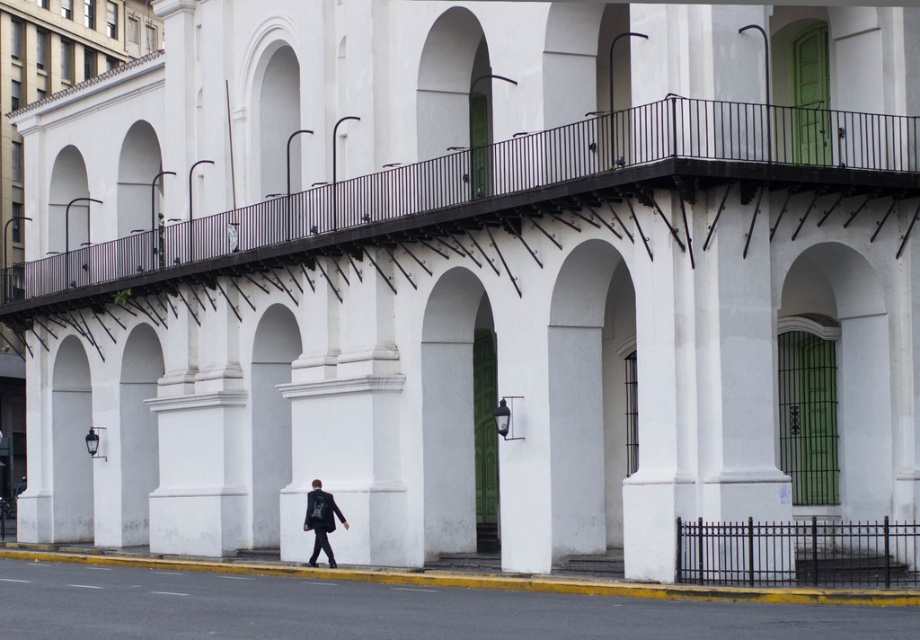
From the picture: You are standing at the entrance of the grand white building and want to locate the black metal railing at upper center. According to the coordinates provided, where exactly should you look to find it?

The black metal railing at upper center is located at the coordinates point (516,180).

You are standing in front of the grand white building and notice two points marked on the facade. The first point is at coordinates point (566,170) and the second at point (713,532). Which of these two points is closer to you?

Point (566,170) is closer to you because it is further to the viewer than point (713,532).